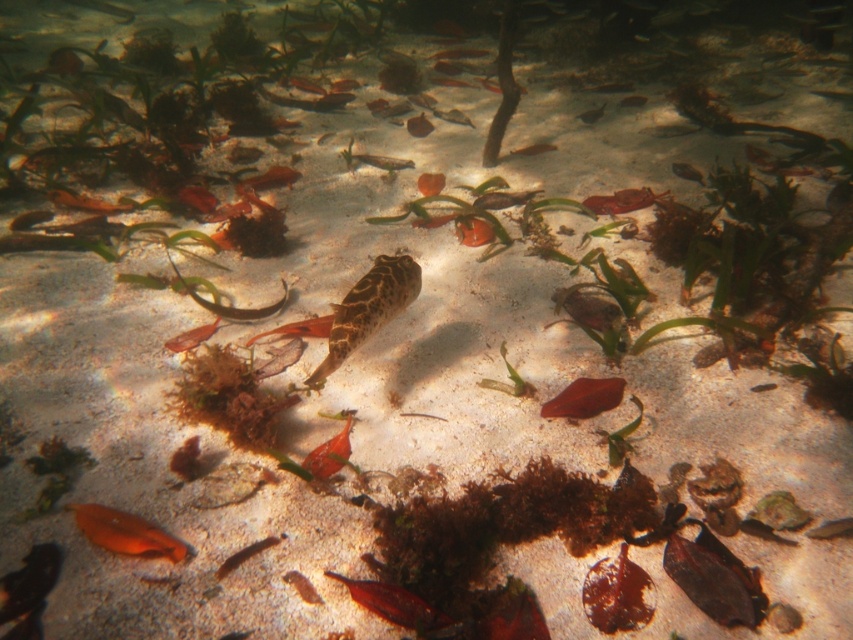
Does shiny red fish at center appear on the right side of smooth brown leaf at lower center?

In fact, shiny red fish at center is to the left of smooth brown leaf at lower center.

Which is more to the right, shiny red fish at center or smooth brown leaf at lower center?

Positioned to the right is smooth brown leaf at lower center.

Is point (434, 630) in front of point (618, 381)?

Yes, point (434, 630) is in front of point (618, 381).

You are a GUI agent. You are given a task and a screenshot of the screen. Output one action in this format:
    pyautogui.click(x=<x>, y=<y>)
    Task: Click on the shiny red fish at center
    
    Given the screenshot: What is the action you would take?
    pyautogui.click(x=393, y=604)

Looking at this image, which is more to the left, orange matte fish at lower left or translucent orange fish at center?

Positioned to the left is orange matte fish at lower left.

Is orange matte fish at lower left to the left of translucent orange fish at center from the viewer's perspective?

Correct, you'll find orange matte fish at lower left to the left of translucent orange fish at center.

The height and width of the screenshot is (640, 853). In order to click on orange matte fish at lower left in this screenshot , I will do `click(125, 532)`.

The height and width of the screenshot is (640, 853). I want to click on orange matte fish at lower left, so click(x=125, y=532).

Which is above, orange matte fish at lower left or shiny red fish at center?

orange matte fish at lower left is above.

What do you see at coordinates (125, 532) in the screenshot? The image size is (853, 640). I see `orange matte fish at lower left` at bounding box center [125, 532].

The height and width of the screenshot is (640, 853). What do you see at coordinates (125, 532) in the screenshot? I see `orange matte fish at lower left` at bounding box center [125, 532].

Locate an element on the screen. The image size is (853, 640). orange matte fish at lower left is located at coordinates (125, 532).